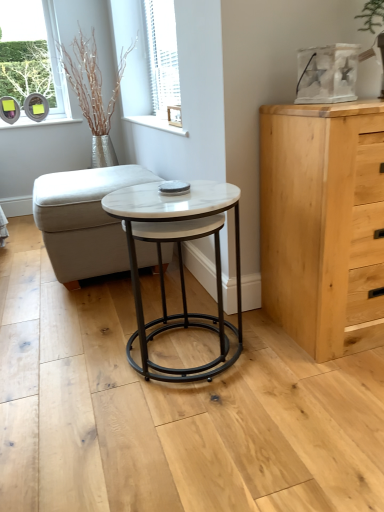
At what (x,y) coordinates should I click in order to perform the action: click on vacant space to the right of white marble coffee table at center. Please return your answer as a coordinate pair (x, y). Looking at the image, I should click on (294, 366).